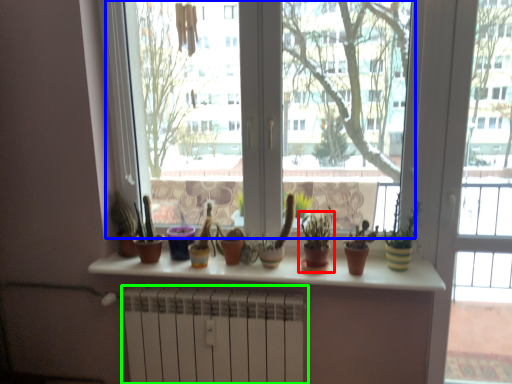
Question: Which is nearer to the houseplant (highlighted by a red box)? window screen (highlighted by a blue box) or radiator (highlighted by a green box).

Choices:
 (A) window screen
 (B) radiator

Answer: (B)